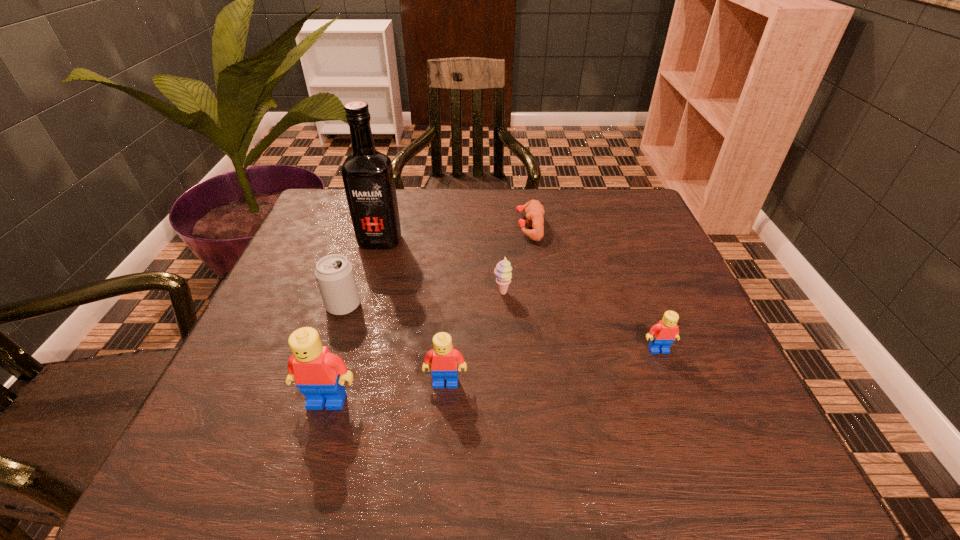
This screenshot has width=960, height=540. I want to click on the nearest object, so click(320, 375).

Find the location of a particular element. the nearest Lego is located at coordinates (320, 375).

I want to click on the second tallest Lego, so click(442, 360).

Identify the location of the fourth object from right to left. The image size is (960, 540). (442, 360).

The width and height of the screenshot is (960, 540). I want to click on the shortest Lego, so point(662,335).

This screenshot has width=960, height=540. Find the location of `the fifth farthest object`. the fifth farthest object is located at coordinates (662, 335).

Where is `the second object from right to left`? The image size is (960, 540). the second object from right to left is located at coordinates (534, 211).

Locate an element on the screen. This screenshot has width=960, height=540. puncher is located at coordinates (534, 211).

The image size is (960, 540). In order to click on the tallest object in this screenshot , I will do [367, 174].

You are a GUI agent. You are given a task and a screenshot of the screen. Output one action in this format:
    pyautogui.click(x=<x>, y=<y>)
    Task: Click on the sherbert
    This screenshot has width=960, height=540.
    Given the screenshot: What is the action you would take?
    pyautogui.click(x=503, y=269)